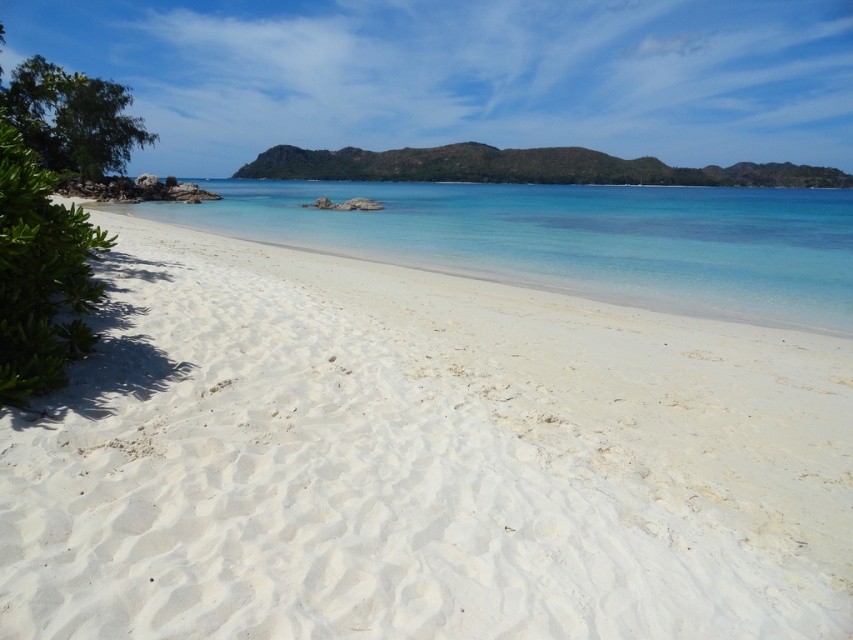
You are standing on the white sandy beach at center and want to reach the clear blue water at center. Based on the scene description, which direction should you move to get to the water?

Since the white sandy beach at center is narrower than the clear blue water at center, you should move forward towards the direction where the beach ends to reach the water.

You are standing on the beach and see two points marked on the sand. The first point is at coordinates point (772, 273) and the second is at point (798, 177). Which point is closer to you?

Point (772, 273) is closer to the viewer than point (798, 177).